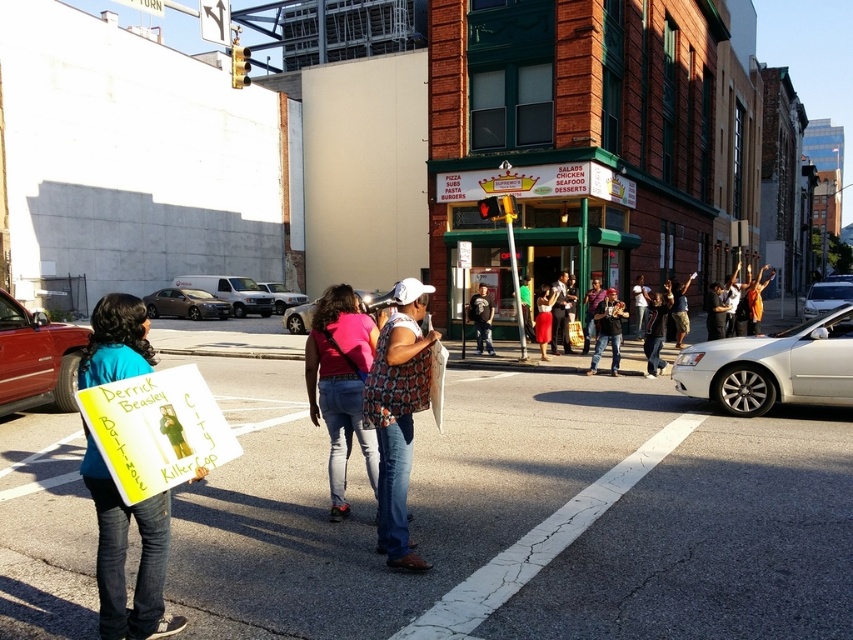
You are a delivery person who needs to park your 2.5 meter wide truck between the silver metallic van at center and the white matte van at center. Is there enough space for your truck to fit between them?

The silver metallic van at center and white matte van at center are 2.88 meters apart from each other. Since your truck is 2.5 meters wide, there is enough space between the two vans to accommodate it.

You are trying to decide which item to take with you for a day out. You have a denim jacket at center and dark blue jeans at center. Which item is wider?

The denim jacket at center is wider than the dark blue jeans at center.

You are a delivery robot with a width of 2.5 feet. You need to navigate between the denim jacket at center and the dark blue jeans at center. Can you fit through the space between them?

The distance between the denim jacket at center and the dark blue jeans at center is 11.07 feet. Since the robot is 2.5 feet wide, it can easily fit through the space between them as the available space is much wider than the robot.